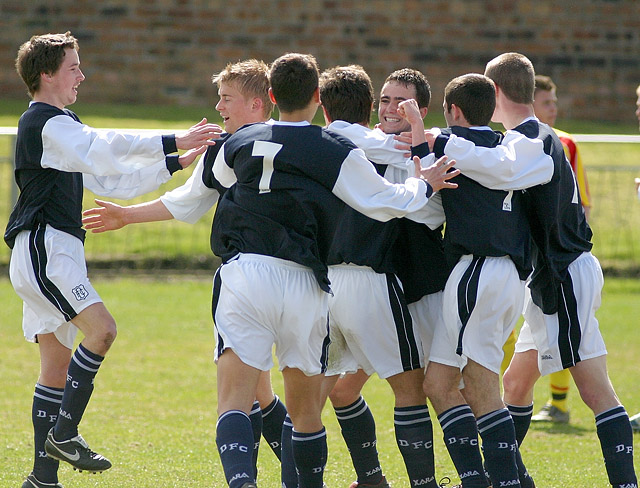
You are a GUI agent. You are given a task and a screenshot of the screen. Output one action in this format:
    pyautogui.click(x=<x>, y=<y>)
    Task: Click on the 1 brick walls
    
    Given the screenshot: What is the action you would take?
    pyautogui.click(x=589, y=45)